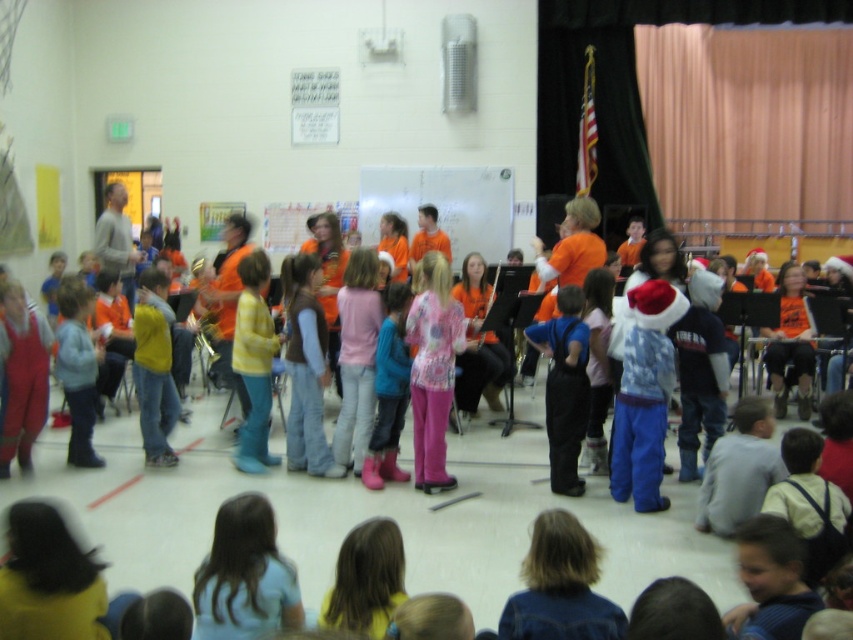
You are a photographer standing at the back of the gymnasium. You want to take a photo of the blue denim overalls at center and the pink rubber boots at center. However, you notice that one of them is blocking the view of the other. Which one is blocking the other?

The blue denim overalls at center is in front of the pink rubber boots at center, so the blue denim overalls at center is blocking the view of the pink rubber boots at center.

You are standing at the point labeled as point [392,321] in the gymnasium. You want to move to the point labeled as point [578,330]. Which direction should you walk to reach your destination?

You should walk forward because point [578,330] is in front of point [392,321].

You are a photographer trying to capture a photo of the blue denim overalls at center and the pink rubber boots at center during the performance. Since you want both items to appear equally sized in the photo, which object should you move closer to and which should you move farther away?

The blue denim overalls at center is wider than the pink rubber boots at center. To make them appear the same size in the photo, move the pink rubber boots at center closer to the camera and the blue denim overalls at center farther away.